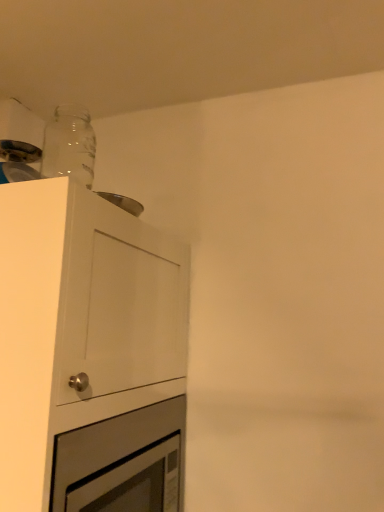
At what (x,y) coordinates should I click in order to perform the action: click on white matte cabinet at upper left. Please return your answer as a coordinate pair (x, y). The width and height of the screenshot is (384, 512). Looking at the image, I should click on (89, 354).

What do you see at coordinates (69, 145) in the screenshot? This screenshot has height=512, width=384. I see `transparent glass bottle at upper left` at bounding box center [69, 145].

Describe the element at coordinates (123, 462) in the screenshot. I see `silver metallic oven at lower left` at that location.

Locate an element on the screen. white matte cabinet at upper left is located at coordinates (89, 354).

Which object is positioned more to the left, transparent glass bottle at upper left or silver metallic oven at lower left?

From the viewer's perspective, transparent glass bottle at upper left appears more on the left side.

Measure the distance from transparent glass bottle at upper left to silver metallic oven at lower left.

transparent glass bottle at upper left and silver metallic oven at lower left are 35.86 inches apart.

From the picture: Can silver metallic oven at lower left be found inside transparent glass bottle at upper left?

No, silver metallic oven at lower left is not inside transparent glass bottle at upper left.

Is transparent glass bottle at upper left not near silver metallic oven at lower left?

transparent glass bottle at upper left is actually quite close to silver metallic oven at lower left.

From the image's perspective, between transparent glass bottle at upper left and white matte cabinet at upper left, who is located below?

white matte cabinet at upper left.

Between transparent glass bottle at upper left and white matte cabinet at upper left, which one appears on the right side from the viewer's perspective?

transparent glass bottle at upper left is more to the right.

The height and width of the screenshot is (512, 384). What are the coordinates of `bottle above the white matte cabinet at upper left (from the image's perspective)` in the screenshot? It's located at (69, 145).

Does transparent glass bottle at upper left have a greater width compared to white matte cabinet at upper left?

No.

Is white matte cabinet at upper left positioned far away from transparent glass bottle at upper left?

They are positioned close to each other.

From the image's perspective, is white matte cabinet at upper left under transparent glass bottle at upper left?

Indeed, from the image's perspective, white matte cabinet at upper left is shown beneath transparent glass bottle at upper left.

From a real-world perspective, which is physically above, white matte cabinet at upper left or transparent glass bottle at upper left?

transparent glass bottle at upper left.

Looking at this image, is silver metallic oven at lower left touching white matte cabinet at upper left?

There is a gap between silver metallic oven at lower left and white matte cabinet at upper left.

What's the angular difference between silver metallic oven at lower left and white matte cabinet at upper left's facing directions?

silver metallic oven at lower left and white matte cabinet at upper left are facing 0.00152 degrees away from each other.

Is silver metallic oven at lower left thinner than white matte cabinet at upper left?

Indeed, silver metallic oven at lower left has a lesser width compared to white matte cabinet at upper left.

How far apart are silver metallic oven at lower left and white matte cabinet at upper left?

15.86 centimeters.

Is the position of silver metallic oven at lower left more distant than that of transparent glass bottle at upper left?

No.

From a real-world perspective, is silver metallic oven at lower left above or below transparent glass bottle at upper left?

silver metallic oven at lower left is below transparent glass bottle at upper left.

Is there a large distance between silver metallic oven at lower left and transparent glass bottle at upper left?

No, there isn't a large distance between silver metallic oven at lower left and transparent glass bottle at upper left.

Which object is positioned more to the right, silver metallic oven at lower left or transparent glass bottle at upper left?

silver metallic oven at lower left.

Based on the photo, from the image's perspective, which is below, white matte cabinet at upper left or silver metallic oven at lower left?

silver metallic oven at lower left, from the image's perspective.

Is white matte cabinet at upper left looking in the opposite direction of silver metallic oven at lower left?

Absolutely, white matte cabinet at upper left is directed away from silver metallic oven at lower left.

From a real-world perspective, is white matte cabinet at upper left physically below silver metallic oven at lower left?

No, from a real-world perspective, white matte cabinet at upper left is not beneath silver metallic oven at lower left.

Is white matte cabinet at upper left bigger or smaller than silver metallic oven at lower left?

In the image, white matte cabinet at upper left appears to be larger than silver metallic oven at lower left.

This screenshot has height=512, width=384. I want to click on bottle behind the silver metallic oven at lower left, so click(x=69, y=145).

Image resolution: width=384 pixels, height=512 pixels. What are the coordinates of `cabinetry lying below the transparent glass bottle at upper left (from the image's perspective)` in the screenshot? It's located at (89, 354).

Considering their positions, is white matte cabinet at upper left positioned closer to silver metallic oven at lower left than transparent glass bottle at upper left?

white matte cabinet at upper left lies closer to silver metallic oven at lower left than the other object.

Which object lies nearer to the anchor point transparent glass bottle at upper left, white matte cabinet at upper left or silver metallic oven at lower left?

The object closer to transparent glass bottle at upper left is white matte cabinet at upper left.

Looking at this image, which object lies further to the anchor point transparent glass bottle at upper left, silver metallic oven at lower left or white matte cabinet at upper left?

Based on the image, silver metallic oven at lower left appears to be further to transparent glass bottle at upper left.

When comparing their distances from silver metallic oven at lower left, does transparent glass bottle at upper left or white matte cabinet at upper left seem closer?

Among the two, white matte cabinet at upper left is located nearer to silver metallic oven at lower left.

Looking at the image, which one is located further to white matte cabinet at upper left, transparent glass bottle at upper left or silver metallic oven at lower left?

transparent glass bottle at upper left lies further to white matte cabinet at upper left than the other object.

Which object lies nearer to the anchor point white matte cabinet at upper left, silver metallic oven at lower left or transparent glass bottle at upper left?

Among the two, silver metallic oven at lower left is located nearer to white matte cabinet at upper left.

What are the coordinates of `cabinetry between transparent glass bottle at upper left and silver metallic oven at lower left in the vertical direction` in the screenshot? It's located at (89, 354).